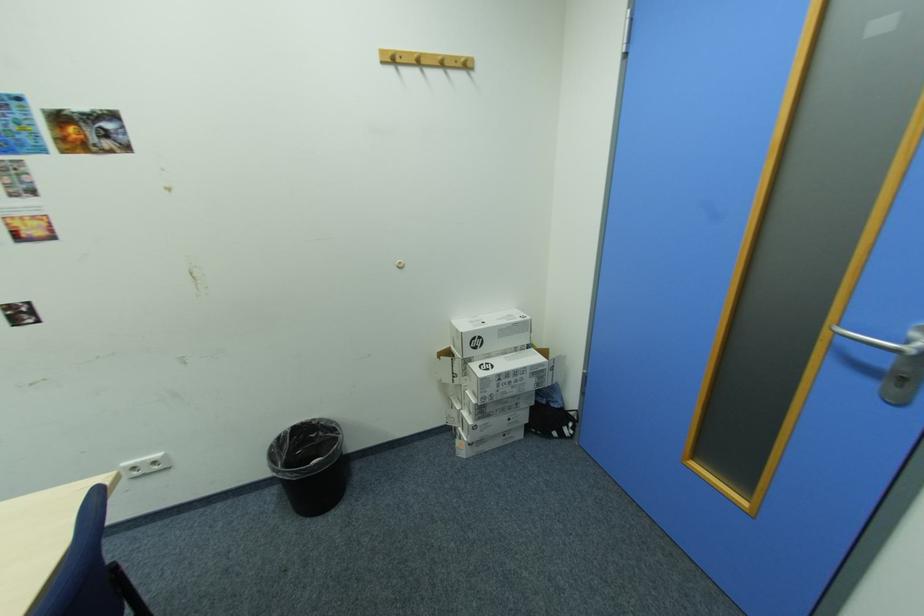
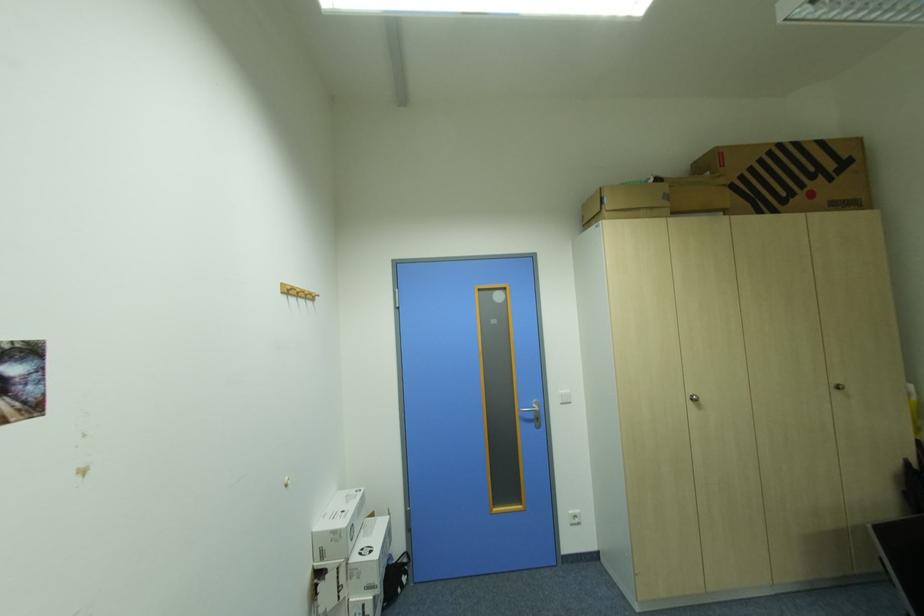
The point at (482, 394) is marked in the first image. Where is the corresponding point in the second image?

(377, 590)